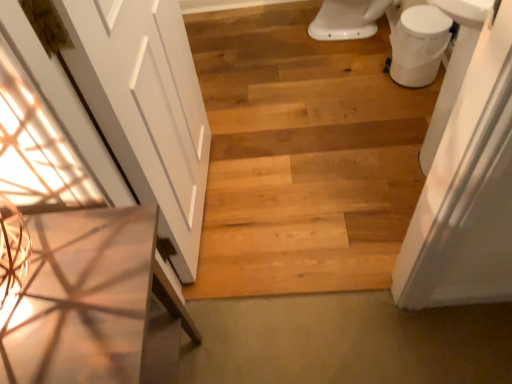
What is the approximate height of white matte door at left?

white matte door at left is 38.91 inches tall.

What do you see at coordinates (95, 303) in the screenshot? Image resolution: width=512 pixels, height=384 pixels. I see `wooden table at left` at bounding box center [95, 303].

Describe the element at coordinates (296, 272) in the screenshot. I see `natural wood plank at center` at that location.

Image resolution: width=512 pixels, height=384 pixels. What are the coordinates of `white matte door at left` in the screenshot? It's located at (146, 107).

Based on the photo, considering the sizes of objects white glossy toilet bowl at upper right and white matte door at left in the image provided, who is shorter, white glossy toilet bowl at upper right or white matte door at left?

With less height is white glossy toilet bowl at upper right.

From a real-world perspective, between white glossy toilet bowl at upper right and white matte door at left, who is vertically higher?

white matte door at left, from a real-world perspective.

From the image's perspective, between white glossy toilet bowl at upper right and white matte door at left, which one is located above?

white glossy toilet bowl at upper right appears higher in the image.

Is white glossy toilet bowl at upper right wider or thinner than white matte door at left?

Considering their sizes, white glossy toilet bowl at upper right looks broader than white matte door at left.

How different are the orientations of white matte door at left and white glossy toilet bowl at upper right in degrees?

179 degrees.

Which object is further away from the camera taking this photo, white matte door at left or white glossy toilet bowl at upper right?

white glossy toilet bowl at upper right is further from the camera.

Is white matte door at left shorter than white glossy toilet bowl at upper right?

No, white matte door at left is not shorter than white glossy toilet bowl at upper right.

Is white matte door at left beside white glossy toilet bowl at upper right?

No, white matte door at left is not making contact with white glossy toilet bowl at upper right.

Between white glossy toilet bowl at upper right and natural wood plank at center, which one is positioned behind?

Positioned behind is white glossy toilet bowl at upper right.

Can you tell me how much white glossy toilet bowl at upper right and natural wood plank at center differ in facing direction?

They differ by 94.4 degrees in their facing directions.

Which of these two, white glossy toilet bowl at upper right or natural wood plank at center, is smaller?

With smaller size is natural wood plank at center.

Based on the photo, is white glossy toilet bowl at upper right to the left of natural wood plank at center from the viewer's perspective?

In fact, white glossy toilet bowl at upper right is to the right of natural wood plank at center.

Is point (390, 270) more distant than point (178, 73)?

That is True.

From the image's perspective, which object appears higher, natural wood plank at center or white matte door at left?

white matte door at left.

Is natural wood plank at center facing away from white matte door at left?

No, natural wood plank at center's orientation is not away from white matte door at left.

Which object is more forward, wooden table at left or white glossy toilet bowl at upper right?

wooden table at left.

Is wooden table at left oriented towards white glossy toilet bowl at upper right?

No, wooden table at left is not facing towards white glossy toilet bowl at upper right.

Measure the distance between wooden table at left and white glossy toilet bowl at upper right.

The distance of wooden table at left from white glossy toilet bowl at upper right is 1.52 meters.

From the picture: Does wooden table at left have a greater height compared to white glossy toilet bowl at upper right?

Indeed, wooden table at left has a greater height compared to white glossy toilet bowl at upper right.

Consider the image. Considering the sizes of objects natural wood plank at center and natural wood floor at center in the image provided, who is taller, natural wood plank at center or natural wood floor at center?

natural wood plank at center is taller.

In the image, there is a natural wood plank at center. Where is `stairwell below it (from a real-world perspective)`? The image size is (512, 384). stairwell below it (from a real-world perspective) is located at coordinates (302, 155).

From a real-world perspective, is natural wood plank at center beneath natural wood floor at center?

Actually, natural wood plank at center is physically above natural wood floor at center in the real world.

From the image's perspective, does wooden table at left appear lower than white matte door at left?

Yes, from the image's perspective, wooden table at left is below white matte door at left.

Which of these two, wooden table at left or white matte door at left, is wider?

With larger width is wooden table at left.

Is wooden table at left positioned beyond the bounds of white matte door at left?

Yes, wooden table at left is not within white matte door at left.

Which object is further away from the camera, wooden table at left or white matte door at left?

white matte door at left is more distant.

Where is `toilet bowl above the white matte door at left (from the image's perspective)`? The height and width of the screenshot is (384, 512). toilet bowl above the white matte door at left (from the image's perspective) is located at coordinates (419, 45).

Where is `door located above the white glossy toilet bowl at upper right (from a real-world perspective)`? This screenshot has width=512, height=384. door located above the white glossy toilet bowl at upper right (from a real-world perspective) is located at coordinates (146, 107).

From the image, which object appears to be farther from natural wood floor at center, white glossy toilet bowl at upper right or natural wood plank at center?

Based on the image, white glossy toilet bowl at upper right appears to be further to natural wood floor at center.

Based on their spatial positions, is white glossy toilet bowl at upper right or natural wood plank at center further from wooden table at left?

white glossy toilet bowl at upper right is positioned further to the anchor wooden table at left.

Looking at the image, which one is located closer to natural wood floor at center, wooden table at left or natural wood plank at center?

natural wood plank at center is closer to natural wood floor at center.

Consider the image. When comparing their distances from wooden table at left, does natural wood floor at center or white glossy toilet bowl at upper right seem further?

Based on the image, white glossy toilet bowl at upper right appears to be further to wooden table at left.

Estimate the real-world distances between objects in this image. Which object is closer to white glossy toilet bowl at upper right, natural wood plank at center or natural wood floor at center?

The object closer to white glossy toilet bowl at upper right is natural wood floor at center.

Based on their spatial positions, is wooden table at left or natural wood floor at center further from white matte door at left?

natural wood floor at center is positioned further to the anchor white matte door at left.

When comparing their distances from natural wood floor at center, does white matte door at left or white glossy toilet bowl at upper right seem closer?

Based on the image, white glossy toilet bowl at upper right appears to be nearer to natural wood floor at center.

Which object lies further to the anchor point wooden table at left, natural wood plank at center or white matte door at left?

The object further to wooden table at left is natural wood plank at center.

Where is `plank between natural wood floor at center and wooden table at left in the vertical direction`? plank between natural wood floor at center and wooden table at left in the vertical direction is located at coordinates (296, 272).

The image size is (512, 384). I want to click on plank between white glossy toilet bowl at upper right and wooden table at left from top to bottom, so click(x=296, y=272).

The image size is (512, 384). What are the coordinates of `door between wooden table at left and white glossy toilet bowl at upper right from front to back` in the screenshot? It's located at (146, 107).

I want to click on door between wooden table at left and natural wood plank at center from front to back, so click(146, 107).